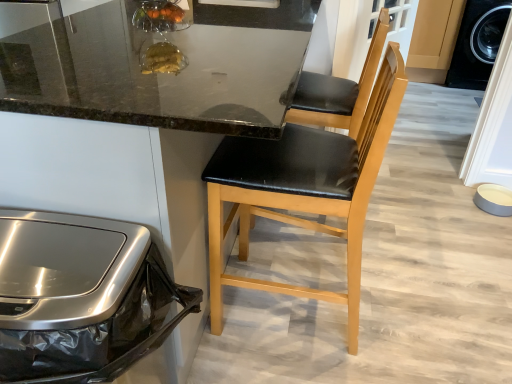
Question: From a real-world perspective, is black leather chair at center above or below matte gray bowl at lower right?

Choices:
 (A) below
 (B) above

Answer: (B)

Question: In the image, is black leather chair at center positioned in front of or behind matte gray bowl at lower right?

Choices:
 (A) behind
 (B) front

Answer: (B)

Question: Which of these objects is positioned farthest from the black leather chair at center?

Choices:
 (A) stainless steel trash can at left
 (B) black leather chair at center
 (C) matte gray bowl at lower right

Answer: (C)

Question: Which is farther from the black leather chair at center?

Choices:
 (A) black leather chair at center
 (B) stainless steel trash can at left
 (C) matte gray bowl at lower right

Answer: (C)